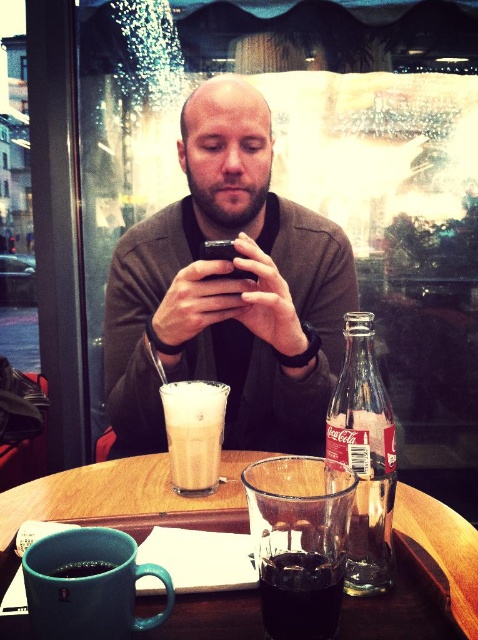
Question: Can you confirm if clear glass coca-cola bottle at right is bigger than white frothy latte at center?

Choices:
 (A) yes
 (B) no

Answer: (A)

Question: Which point is farther to the camera?

Choices:
 (A) (263, 188)
 (B) (6, 492)

Answer: (A)

Question: Can you confirm if matte brown sweater at center is smaller than wooden tray at center?

Choices:
 (A) yes
 (B) no

Answer: (B)

Question: Which object is the farthest from the dark glass at center?

Choices:
 (A) clear glass coca-cola bottle at right
 (B) white frothy latte at center

Answer: (B)

Question: Which object appears closest to the camera in this image?

Choices:
 (A) matte ceramic mug at lower left
 (B) clear glass coca-cola bottle at right
 (C) white frothy latte at center

Answer: (A)

Question: Is clear glass coca-cola bottle at right further to camera compared to matte ceramic mug at lower left?

Choices:
 (A) yes
 (B) no

Answer: (A)